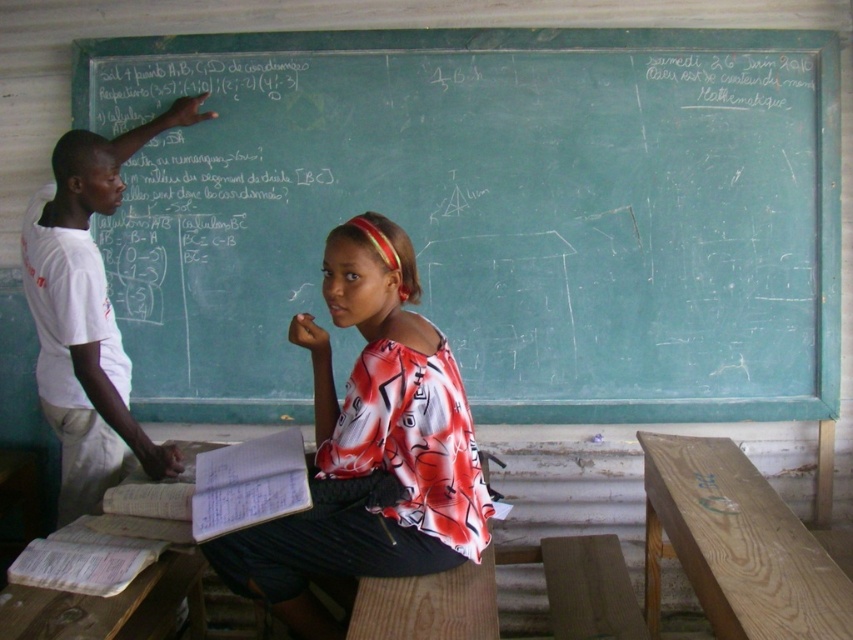
Looking at this image, you are a student in the classroom and need to retrieve a textbook from the light brown wooden table at right without moving the green chalkboard at upper center. Is this possible?

The light brown wooden table at right is behind the green chalkboard at upper center, so you cannot directly access the table from your current position in front of the chalkboard. You would need to move around the chalkboard or find another path to reach the table.

You are a student sitting in the classroom and need to determine which object occupies more space in the scene. Based on the description, which one is bigger between the printed fabric shirt at center and the light brown wooden table at right?

The printed fabric shirt at center has a larger size compared to the light brown wooden table at right, so the printed fabric shirt at center is bigger.